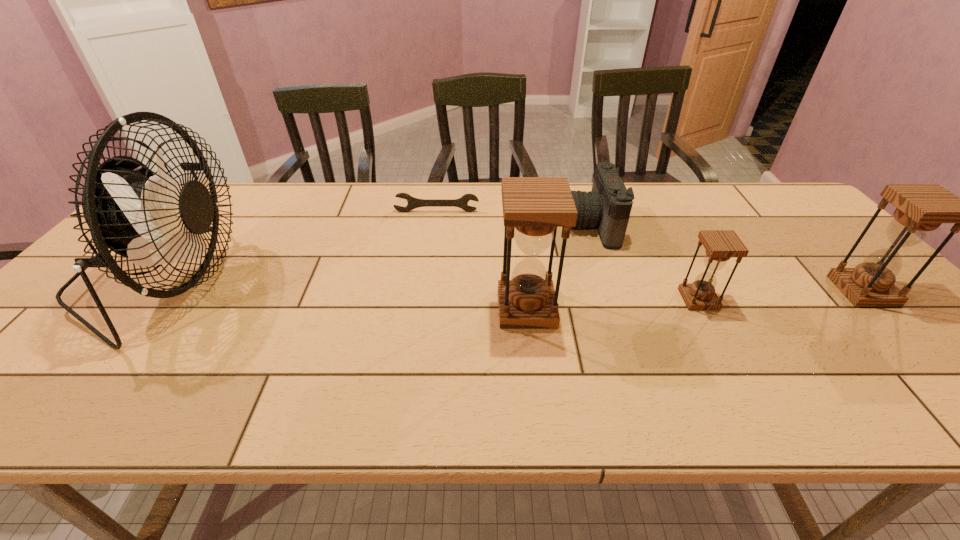
You are a GUI agent. You are given a task and a screenshot of the screen. Output one action in this format:
    pyautogui.click(x=<x>, y=<y>)
    Task: Click on the leftmost hourglass
    The height and width of the screenshot is (540, 960).
    Given the screenshot: What is the action you would take?
    pyautogui.click(x=533, y=207)

Identify the location of the second object from right to left. (721, 245).

Where is `the shortest hourglass`? the shortest hourglass is located at coordinates (721, 245).

At what (x,y) coordinates should I click in order to perform the action: click on the third tallest object. Please return your answer as a coordinate pair (x, y). Image resolution: width=960 pixels, height=540 pixels. Looking at the image, I should click on (920, 208).

Identify the location of the rightmost object. The height and width of the screenshot is (540, 960). (920, 208).

Find the location of a particular element. This screenshot has width=960, height=540. camera is located at coordinates (608, 205).

Locate an element on the screen. the tallest object is located at coordinates (148, 218).

Where is `fan`? The height and width of the screenshot is (540, 960). fan is located at coordinates (148, 218).

The image size is (960, 540). I want to click on the shortest object, so click(x=413, y=203).

The width and height of the screenshot is (960, 540). What are the coordinates of `wrench` in the screenshot? It's located at (413, 203).